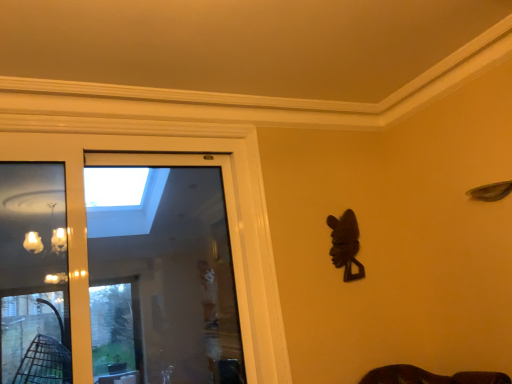
Question: Considering the positions of transparent glass screen door at center and dark brown wood mask at right in the image, is transparent glass screen door at center bigger or smaller than dark brown wood mask at right?

Choices:
 (A) big
 (B) small

Answer: (A)

Question: From a real-world perspective, is transparent glass screen door at center physically located above or below dark brown wood mask at right?

Choices:
 (A) below
 (B) above

Answer: (A)

Question: Considering their positions, is transparent glass screen door at center located in front of or behind dark brown wood mask at right?

Choices:
 (A) behind
 (B) front

Answer: (B)

Question: Is dark brown wood mask at right to the left or to the right of transparent glass screen door at center in the image?

Choices:
 (A) left
 (B) right

Answer: (B)

Question: Is point (343, 215) closer or farther from the camera than point (172, 256)?

Choices:
 (A) closer
 (B) farther

Answer: (A)

Question: Is dark brown wood mask at right bigger or smaller than transparent glass screen door at center?

Choices:
 (A) small
 (B) big

Answer: (A)

Question: From the image's perspective, is dark brown wood mask at right positioned above or below transparent glass screen door at center?

Choices:
 (A) above
 (B) below

Answer: (A)